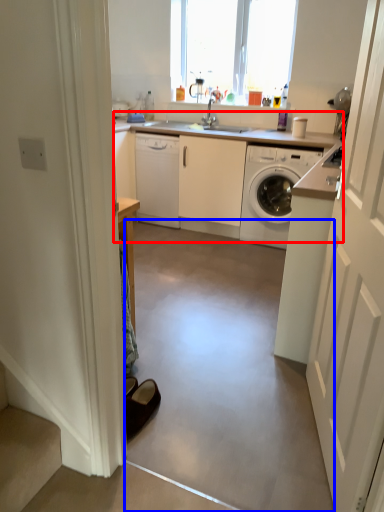
Question: Which of the following is the closest to the observer, counter top (highlighted by a red box) or concrete (highlighted by a blue box)?

Choices:
 (A) counter top
 (B) concrete

Answer: (B)